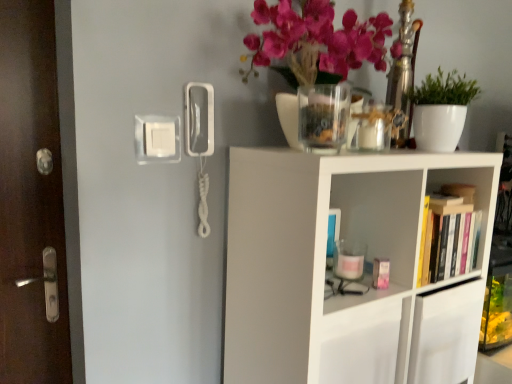
Question: Considering the positions of point (403, 249) and point (57, 221), is point (403, 249) closer or farther from the camera than point (57, 221)?

Choices:
 (A) closer
 (B) farther

Answer: (A)

Question: Considering the positions of white matte shelf at upper right and brown wooden door at left in the image, is white matte shelf at upper right wider or thinner than brown wooden door at left?

Choices:
 (A) wide
 (B) thin

Answer: (A)

Question: Based on their relative distances, which object is farther from the brown wooden door at left?

Choices:
 (A) hardcover book at right
 (B) white matte plant at upper right
 (C) transparent glass jar at upper center
 (D) white matte shelf at upper right

Answer: (B)

Question: Which is nearer to the white matte shelf at upper right?

Choices:
 (A) white matte plant at upper right
 (B) transparent glass jar at upper center
 (C) hardcover book at right
 (D) brown wooden door at left

Answer: (C)